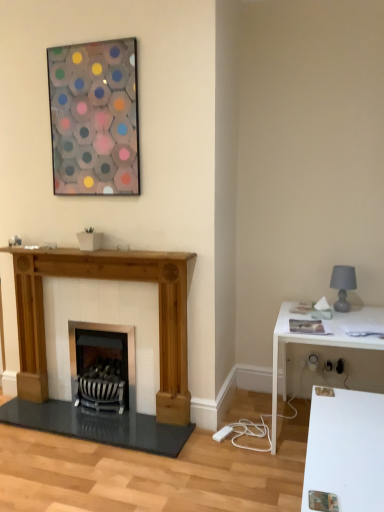
Question: From the image's perspective, is white glossy table at right over natural wood fireplace at left?

Choices:
 (A) yes
 (B) no

Answer: (B)

Question: Is white glossy table at right not inside natural wood fireplace at left?

Choices:
 (A) yes
 (B) no

Answer: (A)

Question: Is white glossy table at right in front of natural wood fireplace at left?

Choices:
 (A) yes
 (B) no

Answer: (A)

Question: Is natural wood fireplace at left at the back of white glossy table at right?

Choices:
 (A) no
 (B) yes

Answer: (A)

Question: Is white glossy table at right wider than natural wood fireplace at left?

Choices:
 (A) yes
 (B) no

Answer: (A)

Question: From a real-world perspective, is black striped wood burning stove at center above or below natural wood fireplace at left?

Choices:
 (A) above
 (B) below

Answer: (B)

Question: In the image, is black striped wood burning stove at center positioned in front of or behind natural wood fireplace at left?

Choices:
 (A) front
 (B) behind

Answer: (B)

Question: From the image's perspective, is black striped wood burning stove at center located above or below natural wood fireplace at left?

Choices:
 (A) above
 (B) below

Answer: (B)

Question: Is black striped wood burning stove at center bigger or smaller than natural wood fireplace at left?

Choices:
 (A) big
 (B) small

Answer: (B)

Question: From a real-world perspective, is black striped wood burning stove at center above or below white glossy table at right?

Choices:
 (A) above
 (B) below

Answer: (B)

Question: In terms of size, does black striped wood burning stove at center appear bigger or smaller than white glossy table at right?

Choices:
 (A) big
 (B) small

Answer: (B)

Question: Would you say black striped wood burning stove at center is to the left or to the right of white glossy table at right in the picture?

Choices:
 (A) right
 (B) left

Answer: (B)

Question: Is point (94, 395) positioned closer to the camera than point (291, 337)?

Choices:
 (A) farther
 (B) closer

Answer: (A)

Question: Would you say translucent glass hexagon at upper center is to the left or to the right of gray matte lampshade at right in the picture?

Choices:
 (A) left
 (B) right

Answer: (A)

Question: From the image's perspective, relative to gray matte lampshade at right, is translucent glass hexagon at upper center above or below?

Choices:
 (A) above
 (B) below

Answer: (A)